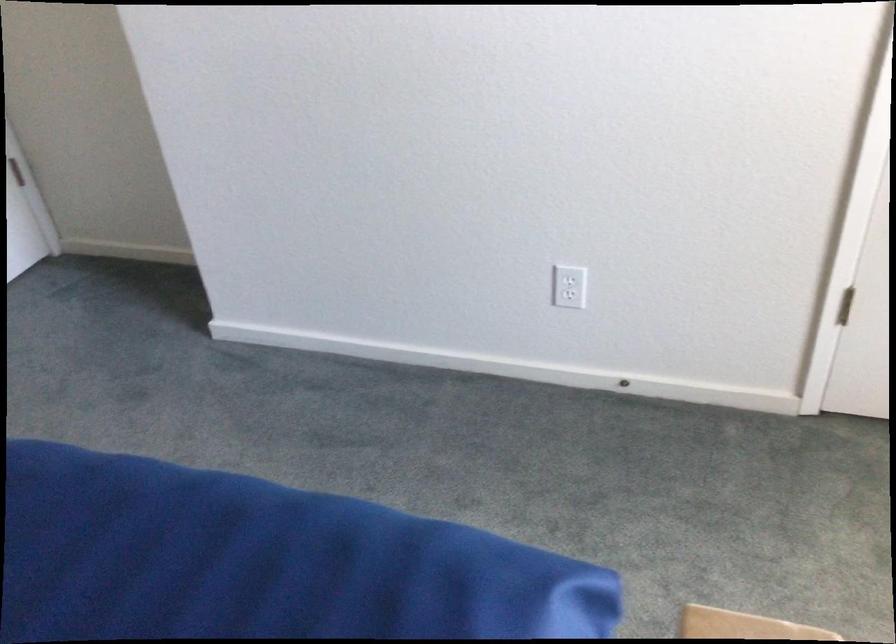
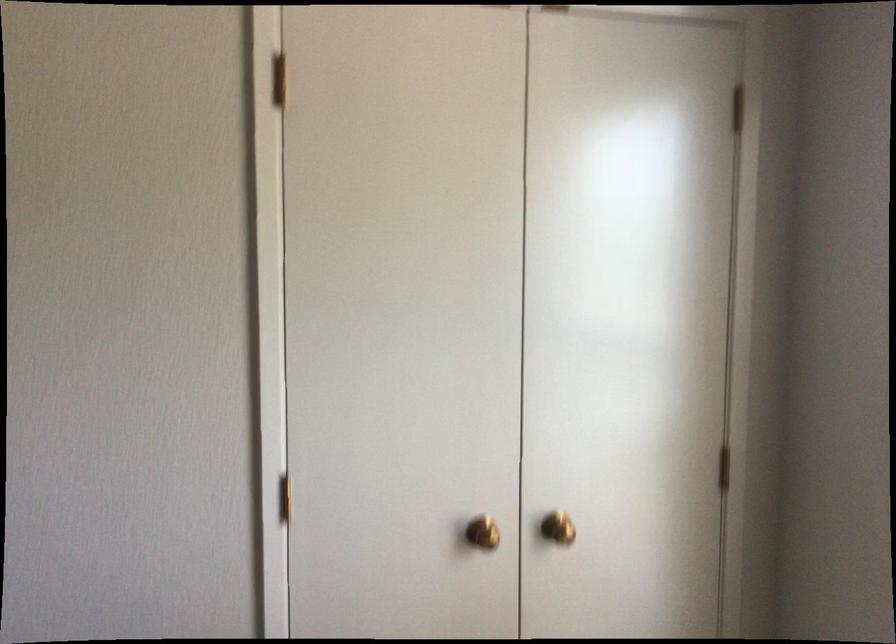
From the picture: The images are taken continuously from a first-person perspective. In which direction is your viewpoint rotating?

The camera's rotation is toward right-up.